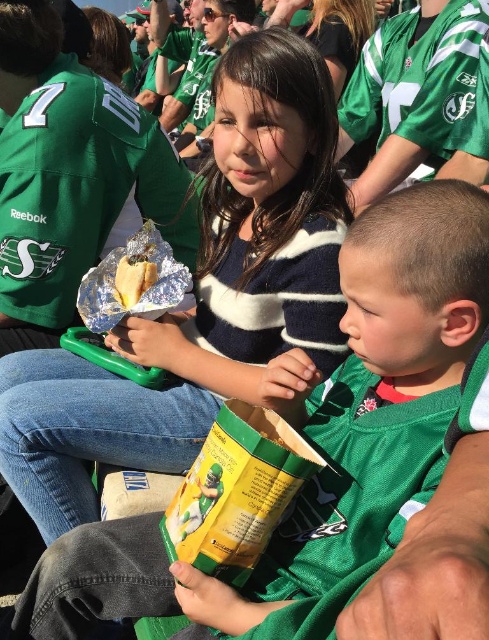
Between green matte jersey at center and shiny foil burrito at center, which one is positioned higher?

Positioned higher is shiny foil burrito at center.

Who is more distant from viewer, (111, 540) or (124, 269)?

Point (124, 269)

This screenshot has height=640, width=489. I want to click on green matte jersey at center, so click(316, 444).

Does striped sweater at center have a smaller size compared to shiny foil burrito at center?

Incorrect, striped sweater at center is not smaller in size than shiny foil burrito at center.

Looking at this image, is striped sweater at center bigger than shiny foil burrito at center?

Yes, striped sweater at center is bigger than shiny foil burrito at center.

Is point (225, 122) closer to viewer compared to point (136, 268)?

Yes, point (225, 122) is in front of point (136, 268).

This screenshot has width=489, height=640. I want to click on striped sweater at center, so tap(201, 296).

Is green matte jersey at center wider than striped sweater at center?

No.

Can you confirm if green matte jersey at center is taller than striped sweater at center?

Incorrect, green matte jersey at center's height is not larger of striped sweater at center's.

This screenshot has height=640, width=489. What do you see at coordinates (316, 444) in the screenshot?
I see `green matte jersey at center` at bounding box center [316, 444].

Where is `green matte jersey at center`? This screenshot has width=489, height=640. green matte jersey at center is located at coordinates (316, 444).